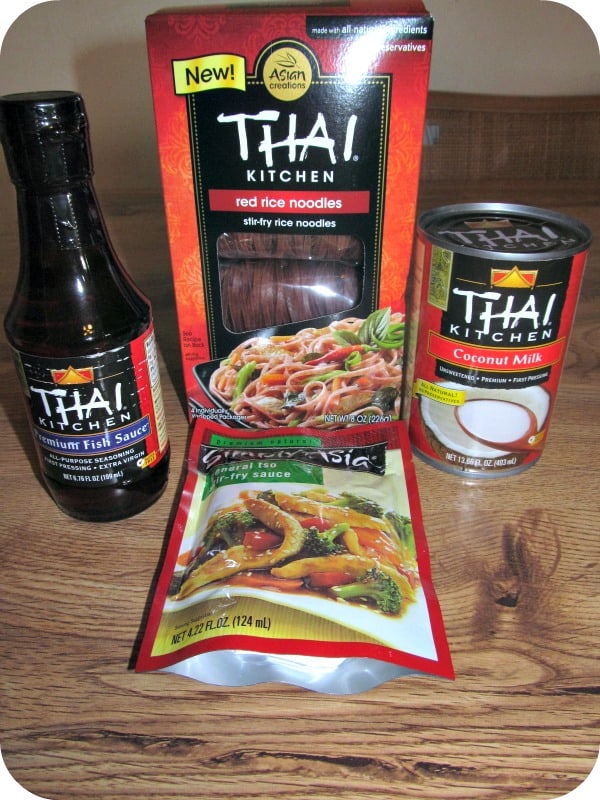
At what (x,y) coordinates should I click in order to perform the action: click on kitchen. Please return your answer as a coordinate pair (x, y). The image size is (600, 800). Looking at the image, I should click on (279, 174).